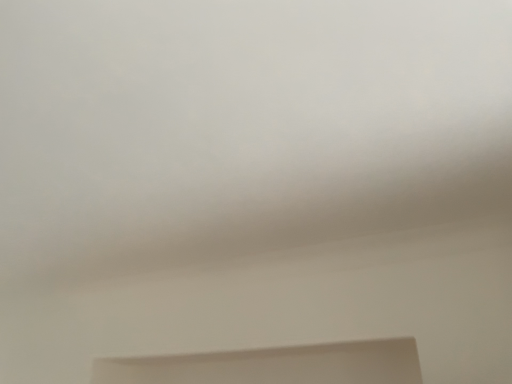
Locate an element on the screen. The width and height of the screenshot is (512, 384). white matte rectangular at lower center is located at coordinates (273, 365).

Image resolution: width=512 pixels, height=384 pixels. Describe the element at coordinates (273, 365) in the screenshot. I see `white matte rectangular at lower center` at that location.

Where is `white matte rectangular at lower center`? white matte rectangular at lower center is located at coordinates [x=273, y=365].